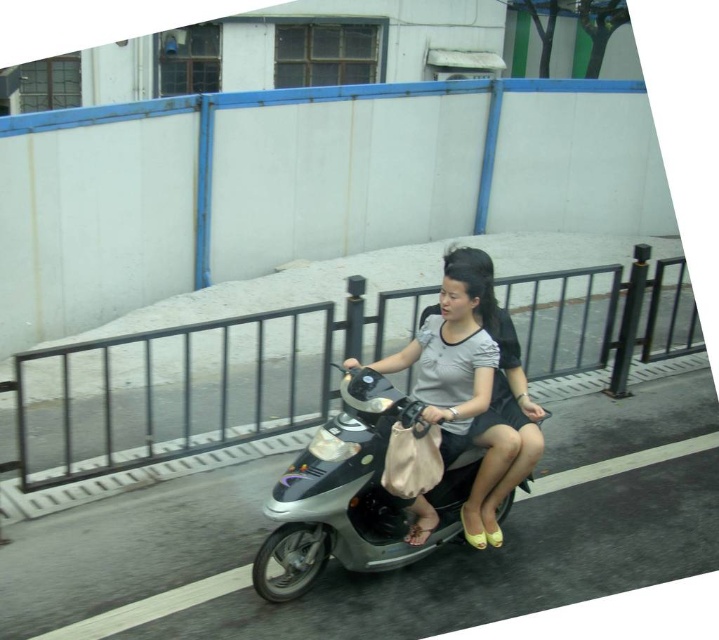
You are a pedestrian standing on the sidewalk next to the road where the scooter is riding. You notice two people wearing light gray matte shirt at center and matte gray shirt at center. Which rider is shorter?

The light gray matte shirt at center is not as tall as matte gray shirt at center, so the rider wearing the light gray matte shirt at center is shorter.